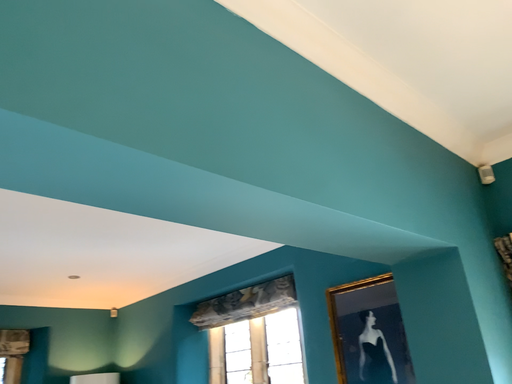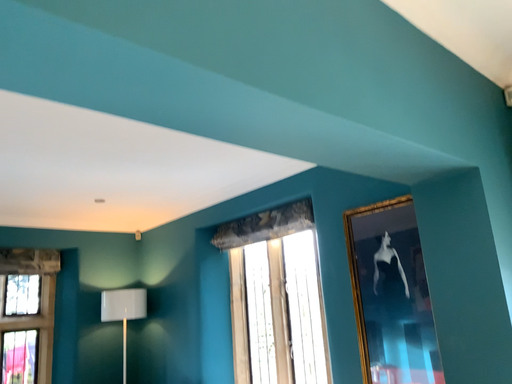
Question: How did the camera likely rotate when shooting the video?

Choices:
 (A) rotated downward
 (B) rotated upward

Answer: (A)